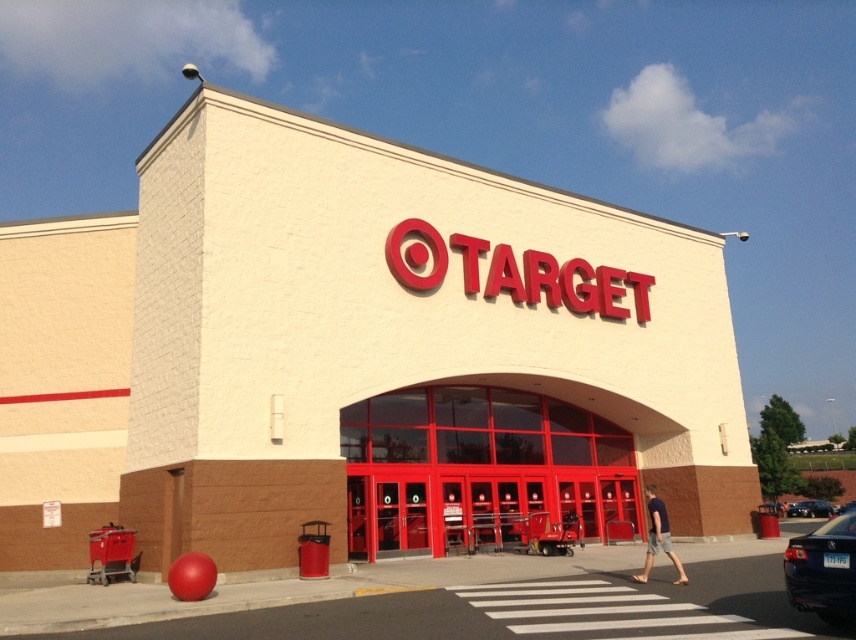
Is shiny glass doors at center further to camera compared to metallic red shopping cart at lower left?

Yes.

Which is behind, point (376, 442) or point (128, 529)?

Positioned behind is point (376, 442).

Identify the location of shiny glass doors at center. (479, 467).

Is shiny glass doors at center taller than shiny black sedan at lower right?

Correct, shiny glass doors at center is much taller as shiny black sedan at lower right.

Does shiny glass doors at center have a lesser width compared to shiny black sedan at lower right?

No.

Image resolution: width=856 pixels, height=640 pixels. I want to click on shiny glass doors at center, so click(x=479, y=467).

The height and width of the screenshot is (640, 856). In order to click on shiny glass doors at center in this screenshot , I will do `click(479, 467)`.

Looking at this image, measure the distance between point (804, 570) and camera.

They are 27.56 feet apart.

Can you confirm if black glossy sedan at lower right is positioned above metallic red shopping cart at lower left?

Actually, black glossy sedan at lower right is below metallic red shopping cart at lower left.

Image resolution: width=856 pixels, height=640 pixels. What do you see at coordinates (823, 570) in the screenshot?
I see `black glossy sedan at lower right` at bounding box center [823, 570].

You are a GUI agent. You are given a task and a screenshot of the screen. Output one action in this format:
    pyautogui.click(x=<x>, y=<y>)
    Task: Click on the black glossy sedan at lower right
    
    Given the screenshot: What is the action you would take?
    point(823,570)